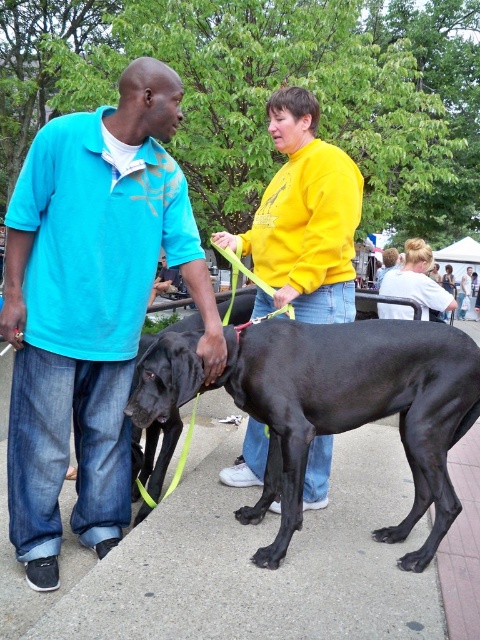
You are a photographer trying to capture a clear photo of the black smooth dog at center without the yellow matte shirt at center blocking the view. Based on their positions, can you position yourself so the dog is fully visible without any obstruction from the shirt?

The black smooth dog at center is in front of the yellow matte shirt at center, so if you position yourself behind the dog, the shirt will be behind the dog and not obstruct the view. Alternatively, moving to the side might allow the dog to be framed without the shirt blocking it, depending on their exact positions.

You are standing at the origin point of the coordinate system. The black smooth dog at center is at point 0.639, 0.738. If you want to walk straight towards the dog, in which direction should you move?

You should move in the direction of the coordinate point (x=354, y=408) to reach the black smooth dog at center.

You are a photographer trying to capture a group photo of the matte blue shirt at center and the black smooth dog at center. If you want to ensure both subjects are in focus, which one should you adjust the camera focus on first?

The matte blue shirt at center is larger in size than the black smooth dog at center, so you should focus on the matte blue shirt at center first to ensure proper focus on the larger subject.